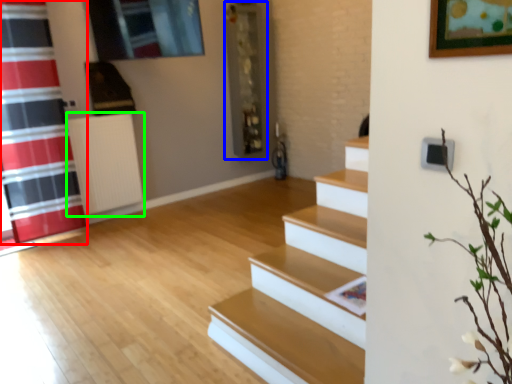
Question: Based on their relative distances, which object is farther from shower curtain (highlighted by a red box)? Choose from shelf (highlighted by a blue box) and radiator (highlighted by a green box).

Choices:
 (A) shelf
 (B) radiator

Answer: (A)